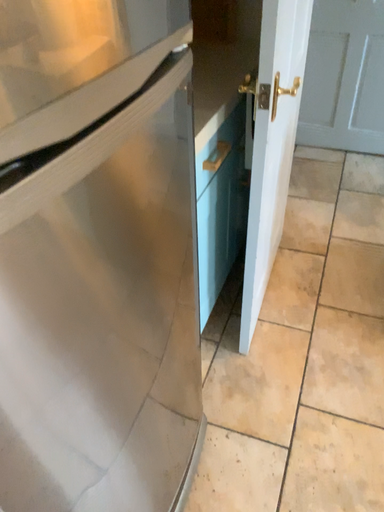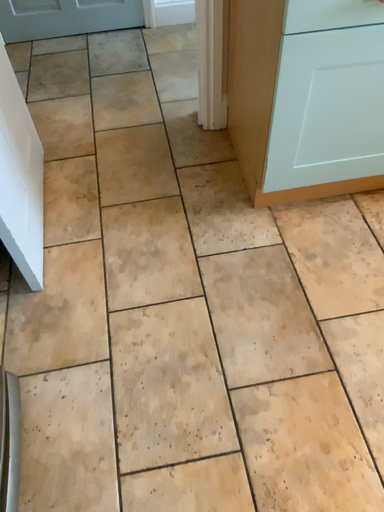
Question: Which way did the camera rotate in the video?

Choices:
 (A) rotated upward
 (B) rotated downward

Answer: (B)